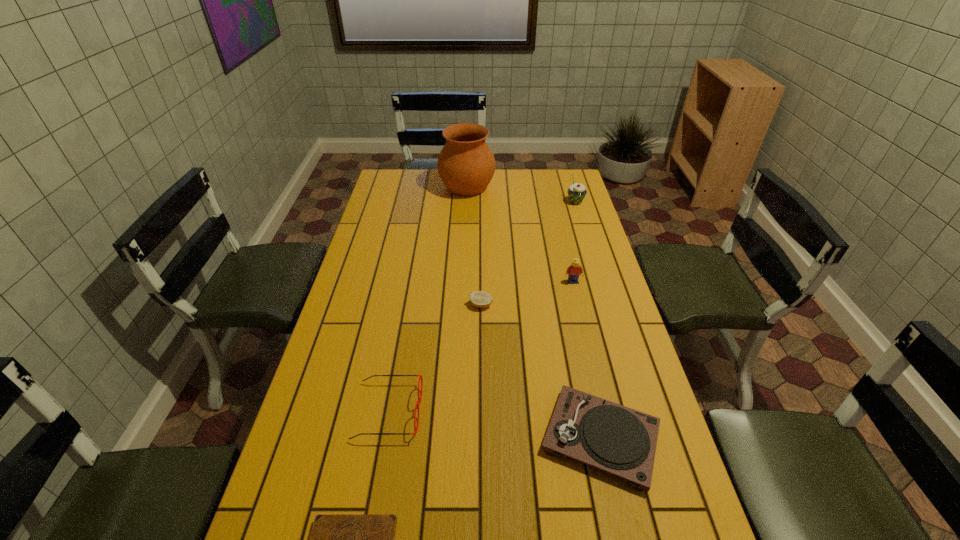
In the image, there is a desktop. Identify the location of vacant space at the left edge. (346, 483).

You are a GUI agent. You are given a task and a screenshot of the screen. Output one action in this format:
    pyautogui.click(x=<x>, y=<y>)
    Task: Click on the vacant space at the right edge of the desktop
    This screenshot has height=540, width=960.
    Given the screenshot: What is the action you would take?
    pyautogui.click(x=610, y=363)

This screenshot has width=960, height=540. Identify the location of free space at the far left corner of the desktop. (411, 179).

In order to click on free space between the phonograph_record and the cupcake in this screenshot , I will do `click(588, 320)`.

Where is `free space between the second shortest object and the Lego`? free space between the second shortest object and the Lego is located at coordinates (527, 293).

Find the location of a particular element. empty location between the third farthest object and the spectacles is located at coordinates (481, 346).

The image size is (960, 540). Identify the location of free point between the Lego and the spectacles. (481, 346).

Locate an element on the screen. Image resolution: width=960 pixels, height=540 pixels. free point between the cupcake and the fifth nearest object is located at coordinates (574, 242).

Point out which object is positioned as the fourth nearest to the Lego. Please provide its 2D coordinates. Your answer should be formatted as a tuple, i.e. [(x, y)], where the tuple contains the x and y coordinates of a point satisfying the conditions above.

[(466, 165)]

Locate which object is the closest to the second tallest object. Please provide its 2D coordinates. Your answer should be formatted as a tuple, i.e. [(x, y)], where the tuple contains the x and y coordinates of a point satisfying the conditions above.

[(466, 165)]